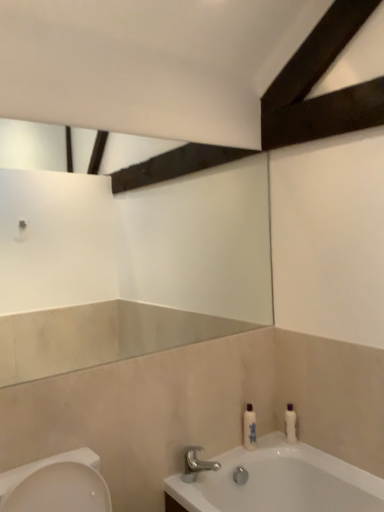
Question: Would you say white glossy bottle at right, acting as the first toiletry starting from the right, is part of polished chrome faucet at lower center's contents?

Choices:
 (A) yes
 (B) no

Answer: (B)

Question: Are polished chrome faucet at lower center and white glossy bottle at right, arranged as the 2th toiletry when viewed from the left, far apart?

Choices:
 (A) yes
 (B) no

Answer: (B)

Question: Is polished chrome faucet at lower center at the left side of white glossy bottle at right, arranged as the 2th toiletry when viewed from the left?

Choices:
 (A) yes
 (B) no

Answer: (A)

Question: Is polished chrome faucet at lower center taller than white glossy bottle at right, acting as the first toiletry starting from the right?

Choices:
 (A) yes
 (B) no

Answer: (B)

Question: From a real-world perspective, is polished chrome faucet at lower center located beneath white glossy bottle at right, acting as the first toiletry starting from the right?

Choices:
 (A) yes
 (B) no

Answer: (A)

Question: From a real-world perspective, relative to white glossy bottle at lower right, the first toiletry viewed from the left, is white glossy bottle at right, acting as the first toiletry starting from the right, vertically above or below?

Choices:
 (A) above
 (B) below

Answer: (B)

Question: In the image, is white glossy bottle at right, arranged as the 2th toiletry when viewed from the left, on the left side or the right side of white glossy bottle at lower right, the first toiletry viewed from the left?

Choices:
 (A) right
 (B) left

Answer: (A)

Question: In the image, is white glossy bottle at right, acting as the first toiletry starting from the right, positioned in front of or behind white glossy bottle at lower right, positioned as the 2th toiletry in right-to-left order?

Choices:
 (A) behind
 (B) front

Answer: (A)

Question: From the image's perspective, relative to white glossy bottle at lower right, the first toiletry viewed from the left, is white glossy bottle at right, acting as the first toiletry starting from the right, above or below?

Choices:
 (A) above
 (B) below

Answer: (B)

Question: From the image's perspective, is white glossy bottle at lower right, the first toiletry viewed from the left, positioned above or below white glossy bottle at right, acting as the first toiletry starting from the right?

Choices:
 (A) above
 (B) below

Answer: (A)

Question: From a real-world perspective, is white glossy bottle at lower right, the first toiletry viewed from the left, physically located above or below white glossy bottle at right, acting as the first toiletry starting from the right?

Choices:
 (A) below
 (B) above

Answer: (B)

Question: Considering the positions of white glossy bottle at lower right, the first toiletry viewed from the left, and white glossy bottle at right, arranged as the 2th toiletry when viewed from the left, in the image, is white glossy bottle at lower right, the first toiletry viewed from the left, taller or shorter than white glossy bottle at right, arranged as the 2th toiletry when viewed from the left,?

Choices:
 (A) short
 (B) tall

Answer: (B)

Question: Is white glossy bottle at lower right, the first toiletry viewed from the left, to the left or to the right of white glossy bottle at right, arranged as the 2th toiletry when viewed from the left, in the image?

Choices:
 (A) left
 (B) right

Answer: (A)

Question: In terms of width, does white glossy bottle at lower right, positioned as the 2th toiletry in right-to-left order, look wider or thinner when compared to polished chrome faucet at lower center?

Choices:
 (A) thin
 (B) wide

Answer: (A)

Question: Is white glossy bottle at lower right, positioned as the 2th toiletry in right-to-left order, to the left or to the right of polished chrome faucet at lower center in the image?

Choices:
 (A) right
 (B) left

Answer: (A)